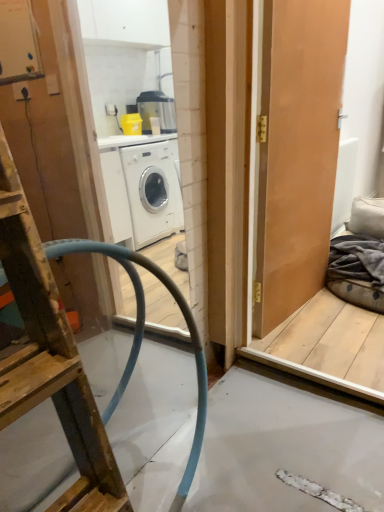
Locate an element on the screen. free area below matte wooden door at right (from a real-world perspective) is located at coordinates (296, 313).